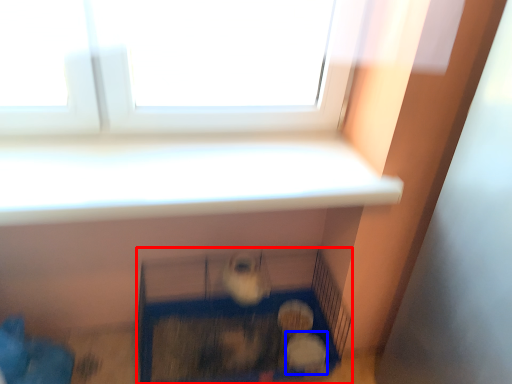
Question: Which object is further to the camera taking this photo, furniture (highlighted by a red box) or animal (highlighted by a blue box)?

Choices:
 (A) furniture
 (B) animal

Answer: (B)